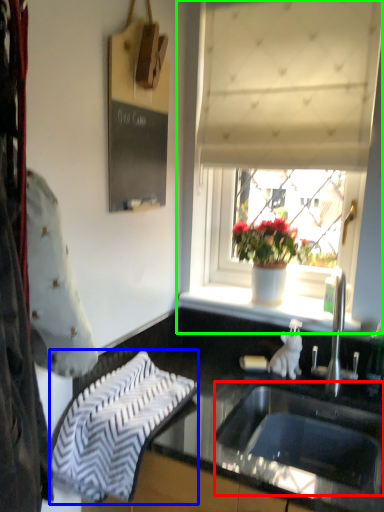
Question: Based on their relative distances, which object is farther from sink (highlighted by a red box)? Choose from beach towel (highlighted by a blue box) and window (highlighted by a green box).

Choices:
 (A) beach towel
 (B) window

Answer: (B)